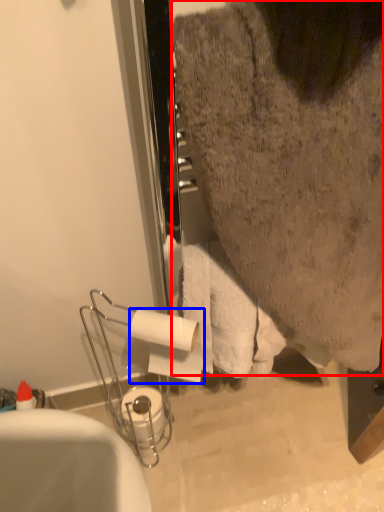
Question: Among these objects, which one is nearest to the camera, person (highlighted by a red box) or toilet paper (highlighted by a blue box)?

Choices:
 (A) person
 (B) toilet paper

Answer: (A)